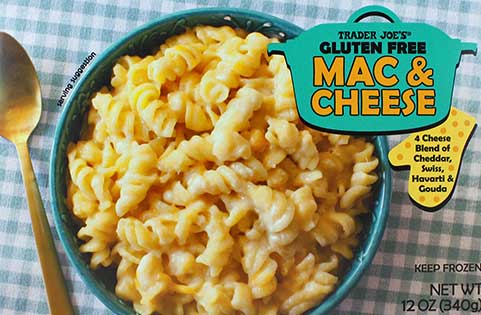
What are the coordinates of `blue cloth` in the screenshot? It's located at (63, 26).